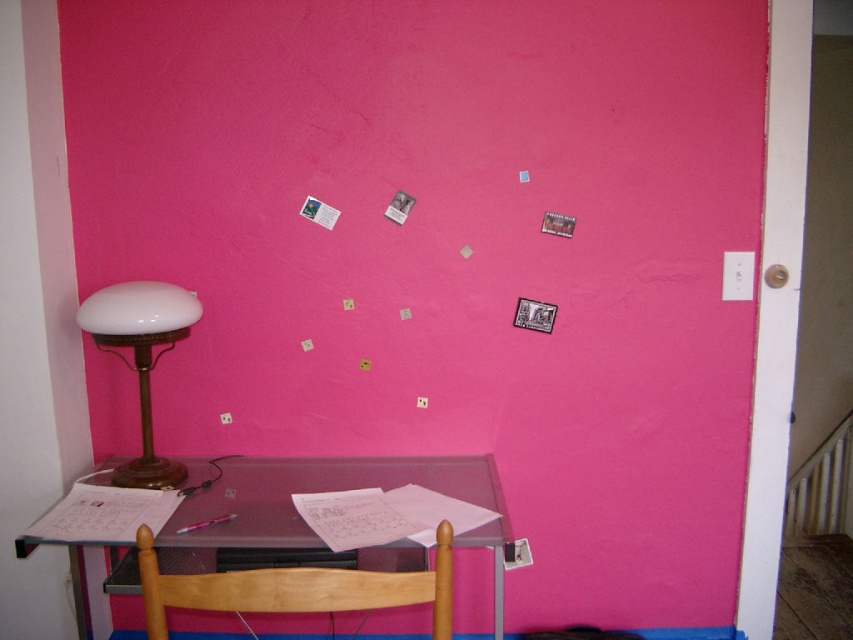
Question: Which of the following is the closest to the observer?

Choices:
 (A) (230, 576)
 (B) (212, 497)

Answer: (A)

Question: Does transparent glass table at lower left come behind white opaline glass lampshade at left?

Choices:
 (A) no
 (B) yes

Answer: (A)

Question: Is wooden chair at lower center to the right of white opaline glass lampshade at left from the viewer's perspective?

Choices:
 (A) no
 (B) yes

Answer: (B)

Question: Among these objects, which one is farthest from the camera?

Choices:
 (A) transparent glass table at lower left
 (B) wooden chair at lower center

Answer: (A)

Question: Which of the following is the closest to the observer?

Choices:
 (A) (183, 472)
 (B) (252, 611)

Answer: (B)

Question: Considering the relative positions of transparent glass table at lower left and wooden chair at lower center in the image provided, where is transparent glass table at lower left located with respect to wooden chair at lower center?

Choices:
 (A) right
 (B) left

Answer: (B)